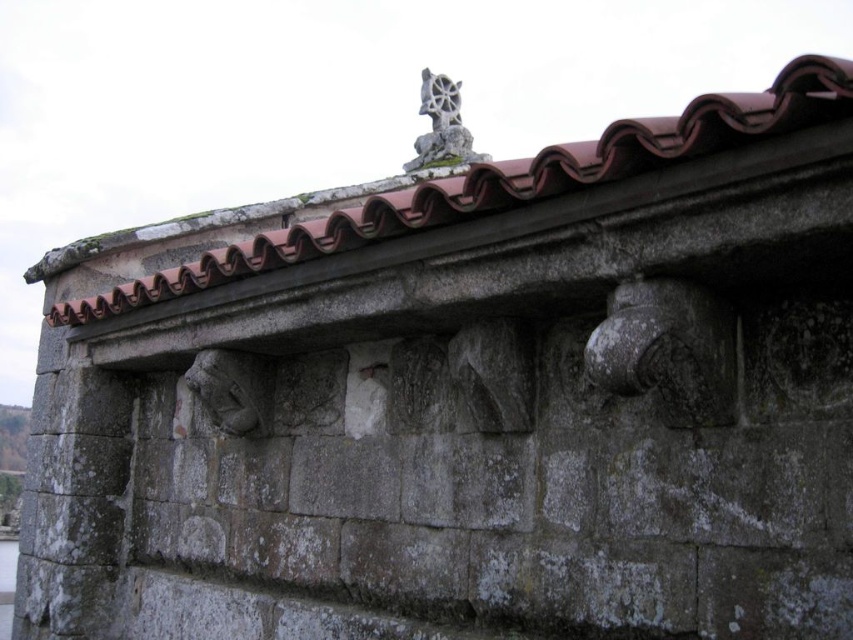
Which is above, brown clay tiles at upper center or gray stone sculpture at upper center?

gray stone sculpture at upper center is higher up.

Between brown clay tiles at upper center and gray stone sculpture at upper center, which one has less height?

Answer: Standing shorter between the two is brown clay tiles at upper center.

Which is behind, point (730, 141) or point (448, 161)?

Point (448, 161)

This screenshot has width=853, height=640. Identify the location of brown clay tiles at upper center. (503, 184).